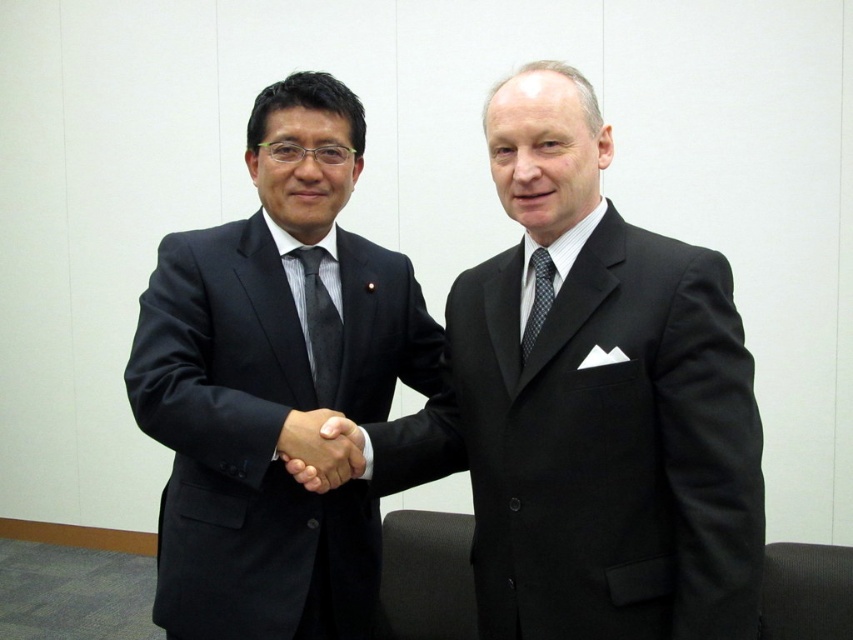
You are standing in the professional setting shown. There are two points marked in the image, point 1 at coordinates point (346,554) and point 2 at coordinates point (323,440). Which point is closer to you?

Point (323,440) is closer to you because it is less further to the camera than point (346,554).

You are an event planner arranging a photo shoot in an office. You need to position a matte black suit at left and a dark gray striped tie at center in the frame. Based on the scene description, which object is positioned to the right of the other?

The dark gray striped tie at center is positioned to the right of the matte black suit at left.

You are an event planner organizing a professional networking event. You need to ensure that the black matte suit at center and the black smooth hand at center are positioned so that the hand is visible to all attendees. Given their current positions, which object should be moved to the right to achieve this?

The black smooth hand at center should be moved to the right so that it is positioned to the right of the black matte suit at center, ensuring visibility.